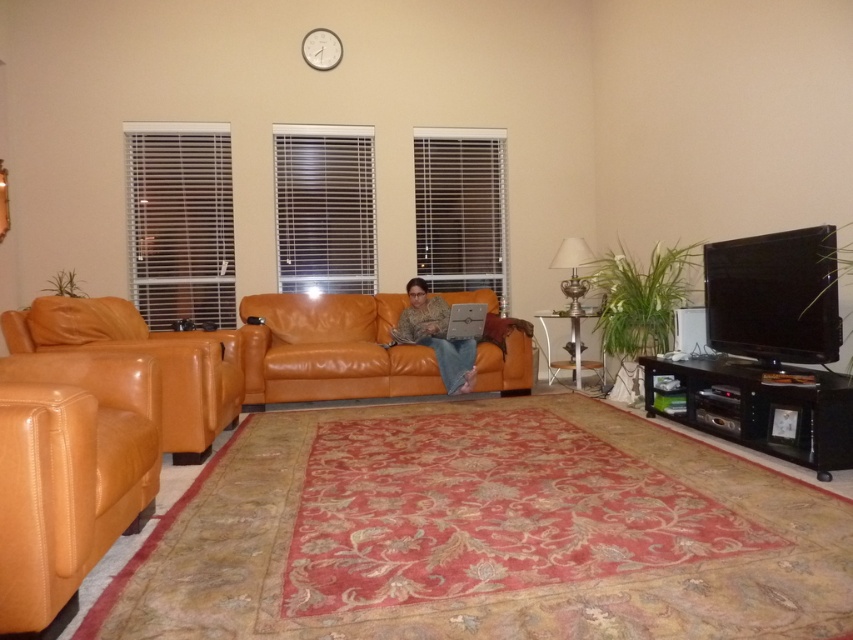
You are standing in the living room and want to move from the saddle brown leather armchair at left to the orange leather couch at center. Which direction should you move to reach the couch?

You should move to the right to reach the orange leather couch at center because the saddle brown leather armchair at left is located to its left.

Looking at this image, you are standing in the living room and want to sit down on the saddle brown leather armchair at left. Which direction should you walk to reach it?

Walk to the left to reach the saddle brown leather armchair at left.

You are planning to place a large rectangular coffee table between the orange leather couch at center and the matte leather chair at left. Considering their widths, which piece of furniture should the table be closer to?

The orange leather couch at center is wider than the matte leather chair at left. Therefore, the coffee table should be positioned closer to the orange leather couch at center to maintain balance and proportion in the seating arrangement.